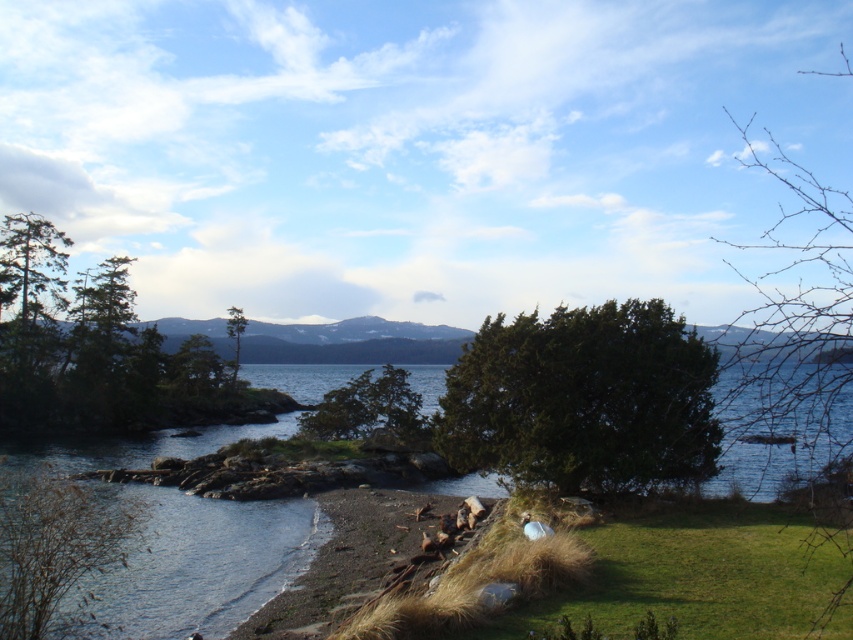
Based on the photo, who is positioned more to the left, brown textured tree at lower left or green leafy tree at upper center?

green leafy tree at upper center

Who is more distant from viewer, [9,600] or [241,324]?

Point [241,324]

Locate an element on the screen. Image resolution: width=853 pixels, height=640 pixels. brown textured tree at lower left is located at coordinates (56, 547).

Does dark green textured tree at center appear on the left side of brown textured tree at lower left?

No, dark green textured tree at center is not to the left of brown textured tree at lower left.

Which is in front, point (695, 364) or point (119, 541)?

Point (119, 541) is more forward.

In order to click on dark green textured tree at center in this screenshot , I will do `click(583, 400)`.

Is green matte tree at left closer to the viewer compared to green leafy tree at center?

No.

Can you confirm if green matte tree at left is thinner than green leafy tree at center?

No.

Is point (114, 301) behind point (381, 397)?

Yes.

Where is `green matte tree at left`? This screenshot has width=853, height=640. green matte tree at left is located at coordinates (97, 349).